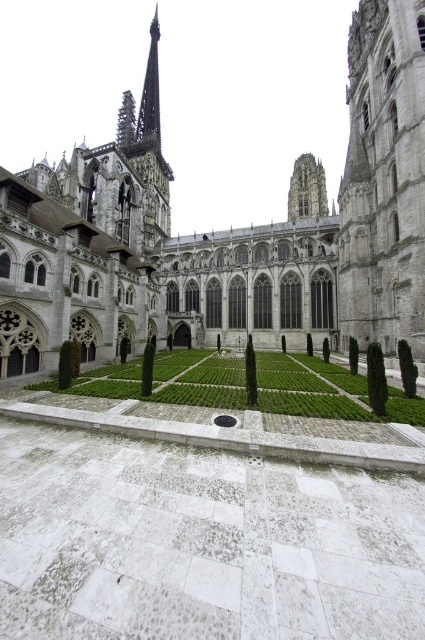
Question: Does green grass at center appear on the left side of white stone courtyard at center?

Choices:
 (A) no
 (B) yes

Answer: (A)

Question: Which point appears closest to the camera in this image?

Choices:
 (A) (201, 262)
 (B) (246, 545)

Answer: (B)

Question: Does green grass at center appear on the right side of white stone courtyard at center?

Choices:
 (A) no
 (B) yes

Answer: (B)

Question: Among these objects, which one is nearest to the camera?

Choices:
 (A) white stone courtyard at center
 (B) green grass at center

Answer: (A)

Question: Is green grass at center smaller than white stone courtyard at center?

Choices:
 (A) yes
 (B) no

Answer: (B)